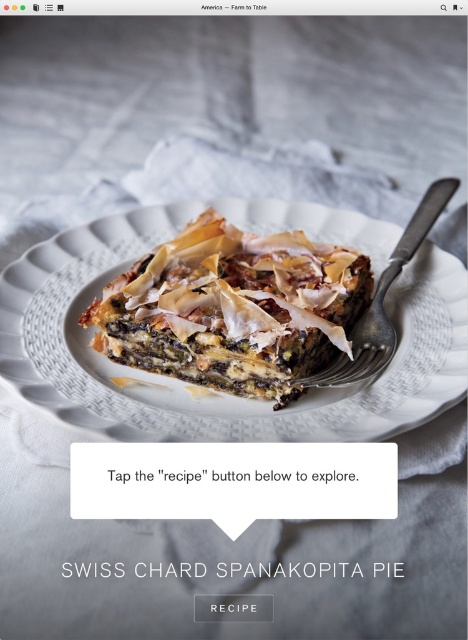
Question: Is silver metallic fork at center-right thinner than white matte button at center?

Choices:
 (A) yes
 (B) no

Answer: (B)

Question: Estimate the real-world distances between objects in this image. Which object is closer to the golden-brown phyllo pastry at center?

Choices:
 (A) white paper text at center
 (B) white matte button at center
 (C) silver metallic fork at center-right

Answer: (C)

Question: Which of the following is the closest to the observer?

Choices:
 (A) (385, 284)
 (B) (284, 573)
 (C) (110, 472)
 (D) (133, 324)

Answer: (B)

Question: Which point appears farthest from the camera in this image?

Choices:
 (A) (425, 214)
 (B) (72, 566)
 (C) (280, 284)

Answer: (A)

Question: Where is silver metallic fork at center-right located in relation to white paper text at center in the image?

Choices:
 (A) right
 (B) left

Answer: (A)

Question: Can you confirm if golden-brown phyllo pastry at center is bigger than white paper text at center?

Choices:
 (A) yes
 (B) no

Answer: (A)